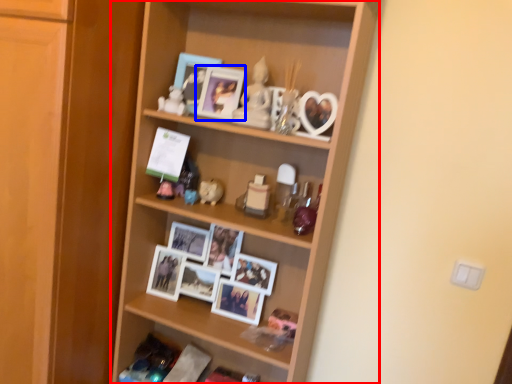
Question: Which of the following is the closest to the observer, shelf (highlighted by a red box) or picture frame (highlighted by a blue box)?

Choices:
 (A) shelf
 (B) picture frame

Answer: (A)